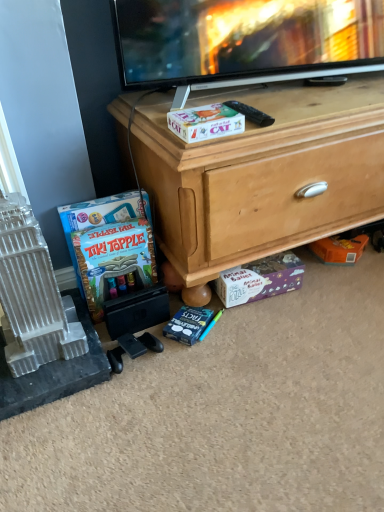
In order to click on free spot to the right of matte board game at lower left in this screenshot , I will do `click(193, 324)`.